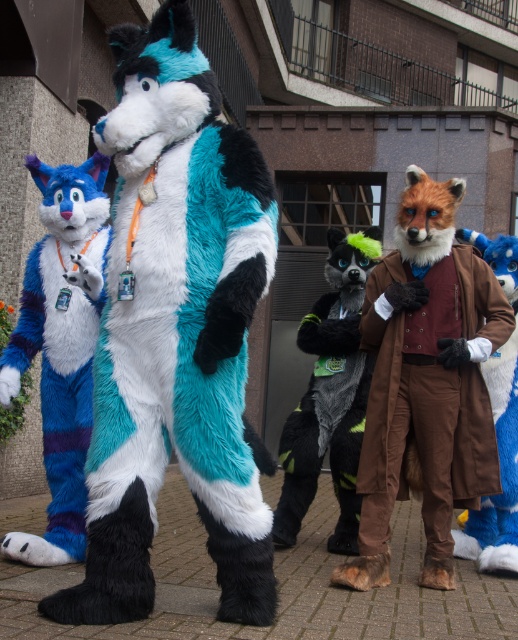
Can you confirm if black fur coat at center is positioned to the right of brown fuzzy coat at right?

Incorrect, black fur coat at center is not on the right side of brown fuzzy coat at right.

Who is taller, black fur coat at center or brown fuzzy coat at right?

black fur coat at center is taller.

Describe the element at coordinates (329, 396) in the screenshot. I see `black fur coat at center` at that location.

Identify the location of black fur coat at center. (329, 396).

Looking at this image, is teal fur coat at center bigger than brown fuzzy coat at right?

Correct, teal fur coat at center is larger in size than brown fuzzy coat at right.

Which is in front, point (159, 340) or point (510, 250)?

Point (159, 340)

At what (x,y) coordinates should I click in order to perform the action: click on teal fur coat at center. Please return your answer as a coordinate pair (x, y). The image size is (518, 640). Looking at the image, I should click on (176, 332).

Consider the image. Who is higher up, brown textured coat at center or brown fuzzy coat at right?

brown textured coat at center

Between point (443, 252) and point (500, 236), which one is positioned behind?

Positioned behind is point (500, 236).

This screenshot has width=518, height=640. Identify the location of brown textured coat at center. (426, 381).